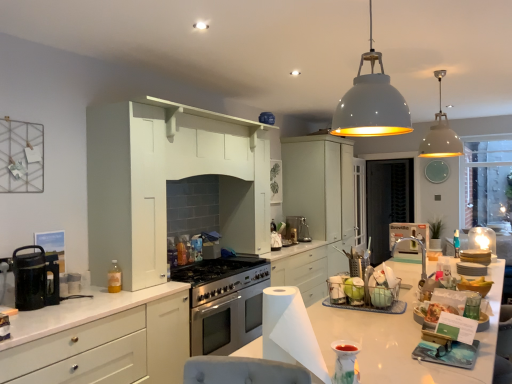
Where is `empty space that is ontop of matte white plates at right, marked as the 2th appliance in a right-to-left arrangement (from a real-world perspective)`? empty space that is ontop of matte white plates at right, marked as the 2th appliance in a right-to-left arrangement (from a real-world perspective) is located at coordinates (478, 244).